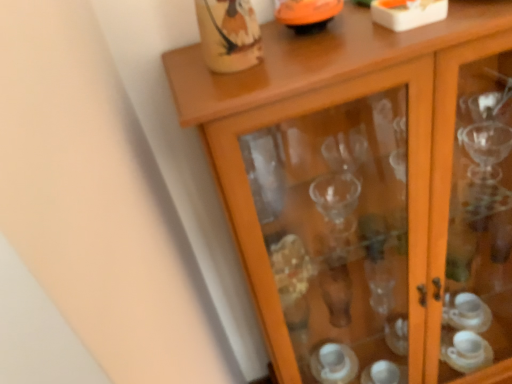
Locate an element on the screen. The image size is (512, 384). free point to the right of orange glossy bowl at upper center is located at coordinates (379, 23).